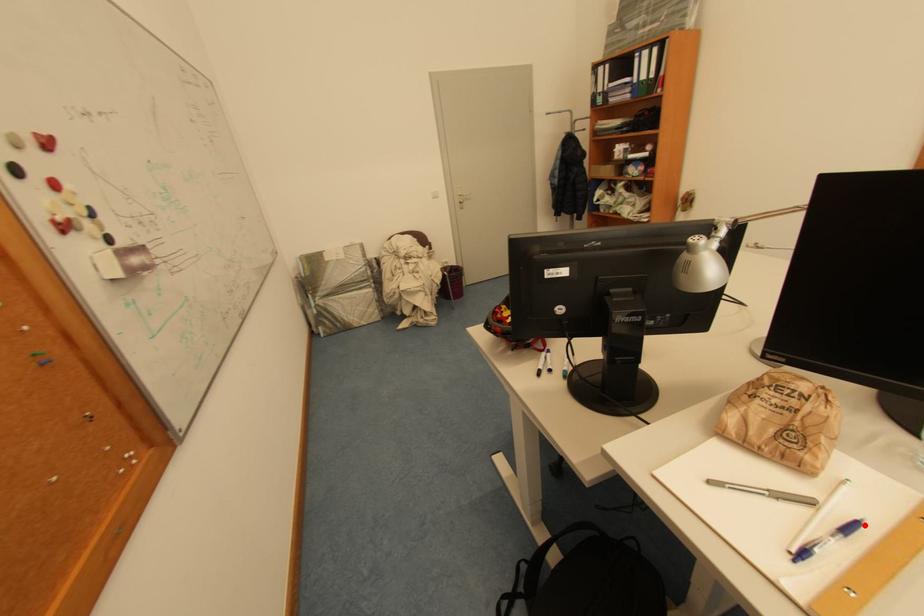
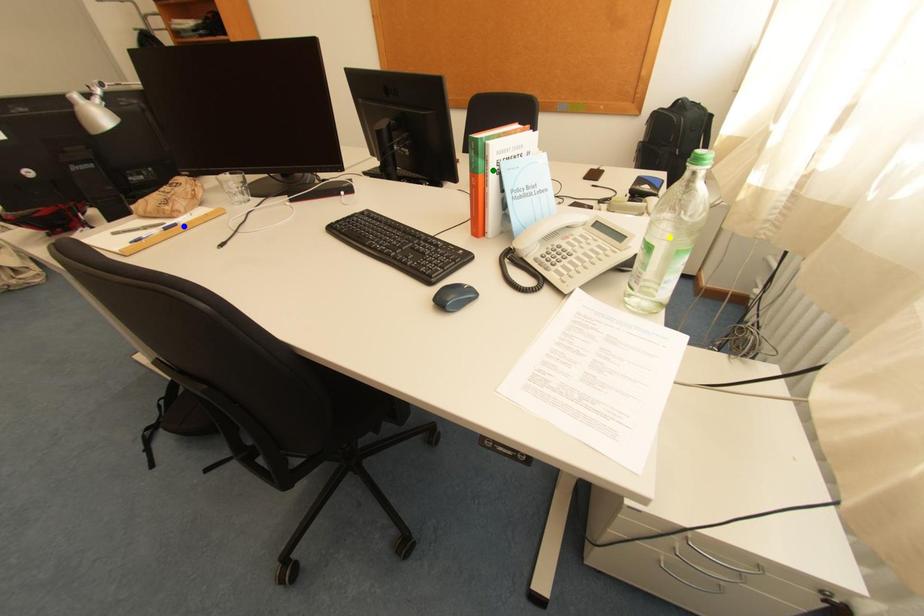
Question: I am providing you with two images of the same scene from different viewpoints. A red point is marked on the first image. You are given multiple points on the second image. Which spot in image 2 lines up with the point in image 1?

Choices:
 (A) blue point
 (B) yellow point
 (C) green point

Answer: (A)